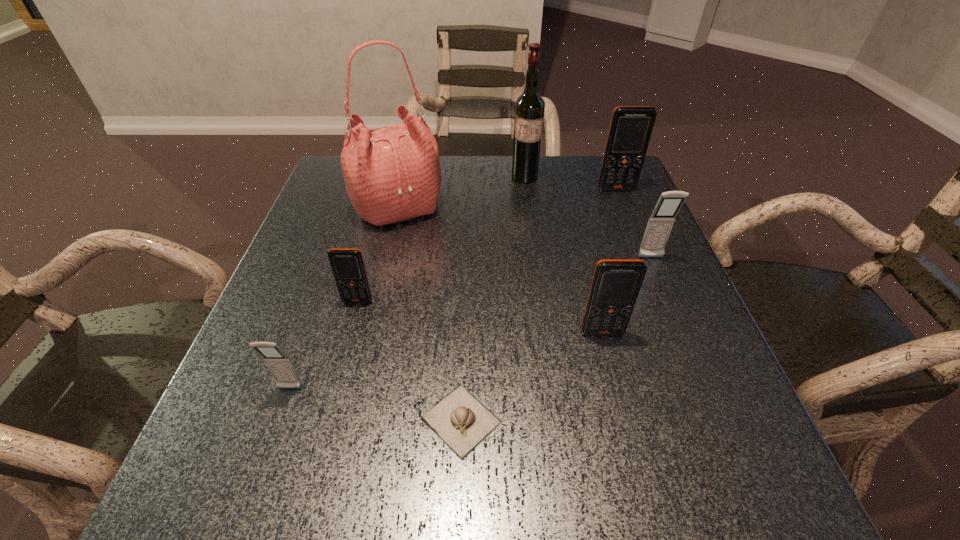
Image resolution: width=960 pixels, height=540 pixels. What are the coordinates of `free spot that satisfies the following two spatial constraints: 1. on the screen of the second cellular telephone from left to right; 2. on the left side of the garlic` in the screenshot? It's located at pos(325,420).

Identify the location of free space that satisfies the following two spatial constraints: 1. on the front side of the shortest object; 2. on the right side of the handbag. (349, 420).